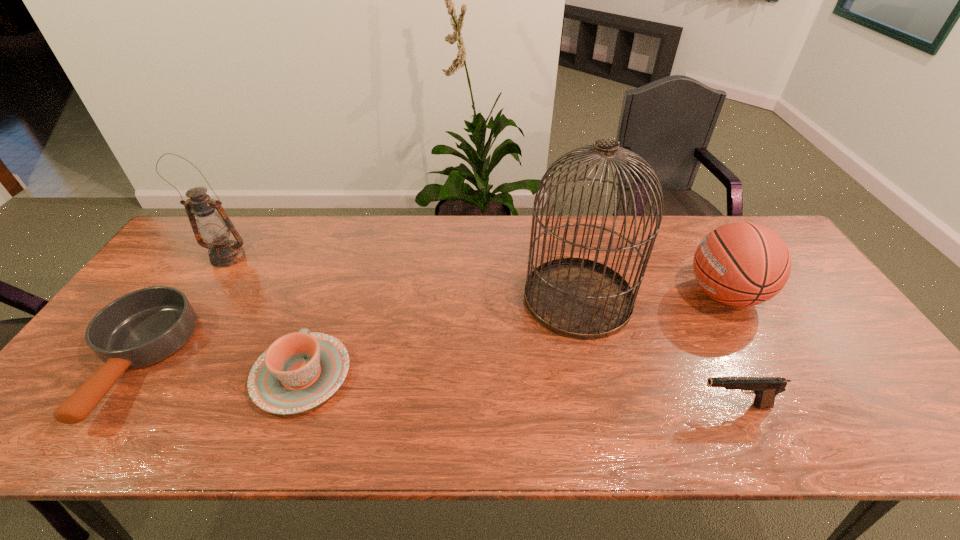
Identify the location of object that is the second nearest to the birdcage. Image resolution: width=960 pixels, height=540 pixels. (765, 389).

Identify which object is the fifth nearest to the fourth tallest object. Please provide its 2D coordinates. Your answer should be formatted as a tuple, i.e. [(x, y)], where the tuple contains the x and y coordinates of a point satisfying the conditions above.

[(213, 226)]

Locate an element on the screen. free region that satisfies the following two spatial constraints: 1. on the logo side of the fourth shortest object; 2. on the handle side of the pan is located at coordinates (763, 362).